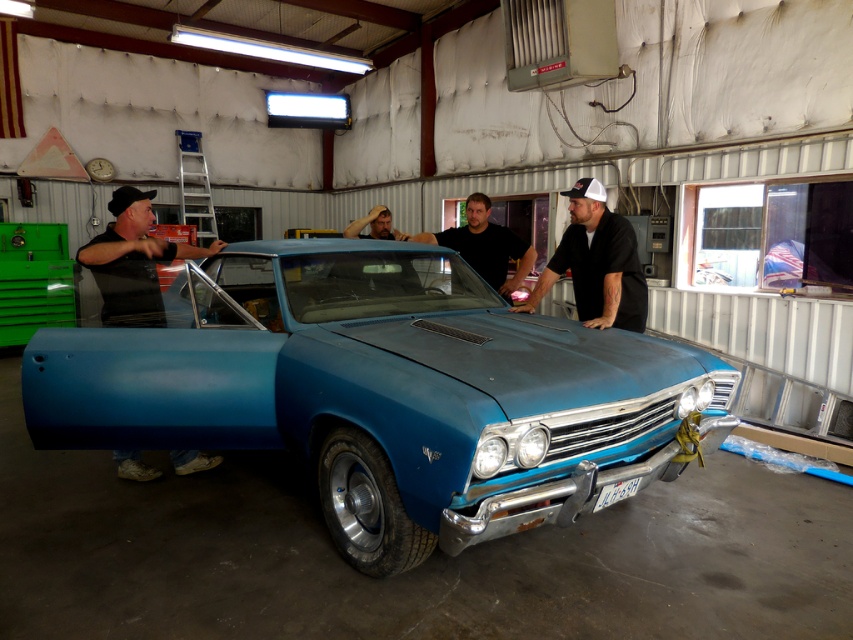
You are a photographer trying to capture a wide shot of the blue matte car at center and the black matte shirt at center in the garage. Given the camera you have can only focus on objects within a 1.5 meters width, will both objects fit in the frame?

The blue matte car at center is wider than the black matte shirt at center. Since the camera can only focus on objects within a 1.5 meters width, and the car is wider, it may not fit entirely within the frame. However, the shirt is narrower, so it should fit. Therefore, both objects might not fit entirely together in the frame due to the car exceeding the width limit.

You are standing in a garage and see the blue matte car at center and the black matte shirt at center. If you want to place a 36 inch long ladder between them, will there be enough space?

The blue matte car at center is 37.36 inches away from the black matte shirt at center. Since the ladder is 36 inches long, there is enough space to place it between them as the distance is slightly longer than the ladder.

You are a fashion designer observing two men in a garage. You notice a black matte shirt at left and a black matte shirt at center. Which man is wearing a wider shirt?

The black matte shirt at center is wider than the black matte shirt at left.